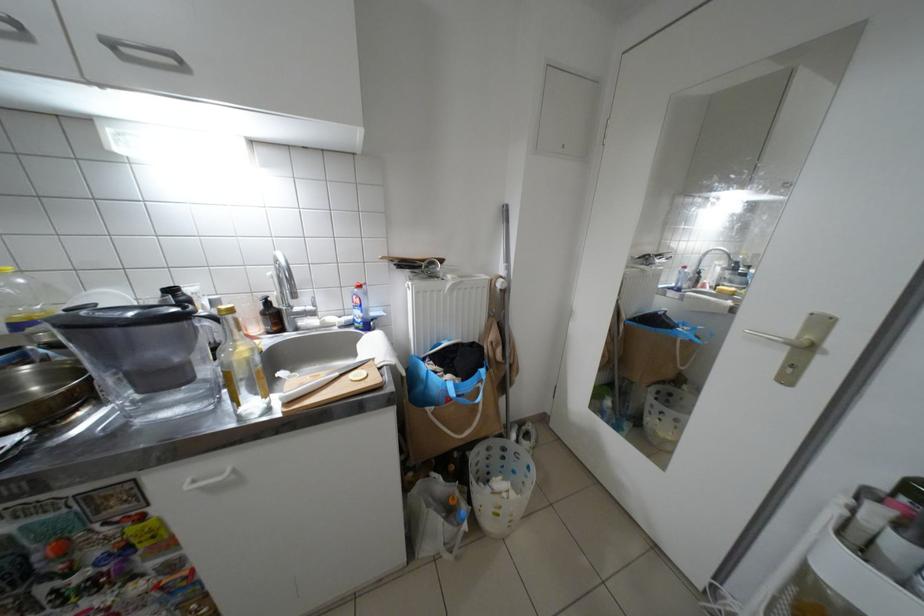
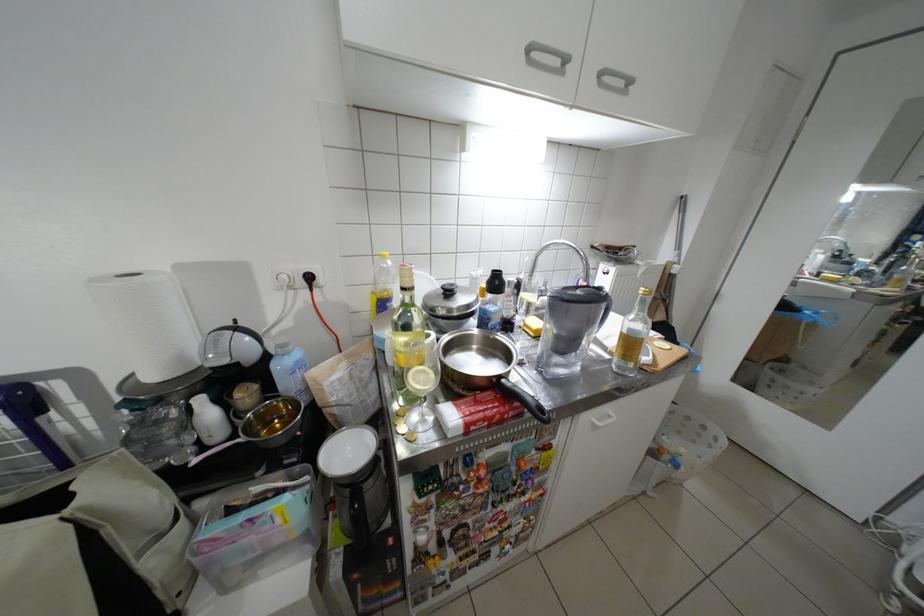
Where in the second image is the point corresponding to [297,403] from the first image?

(662, 363)